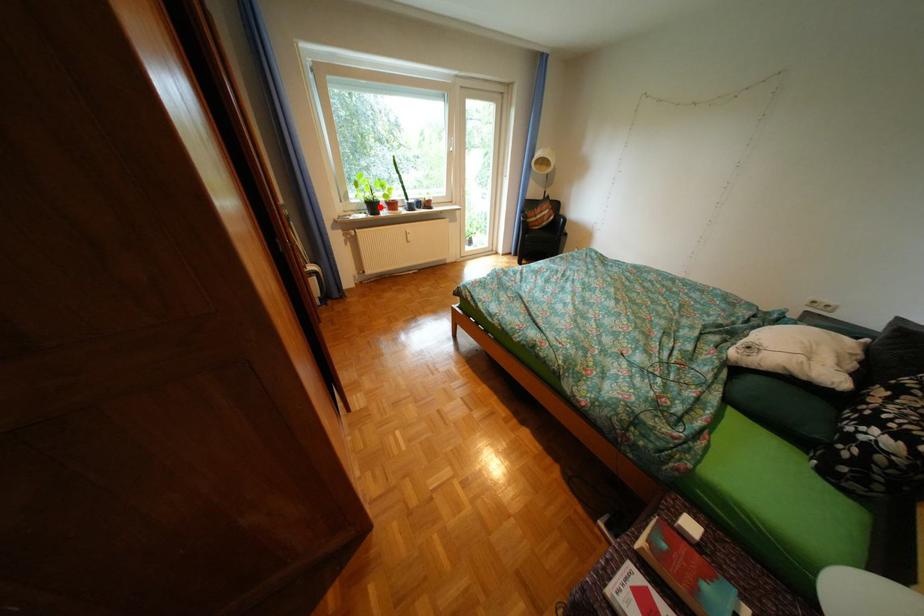
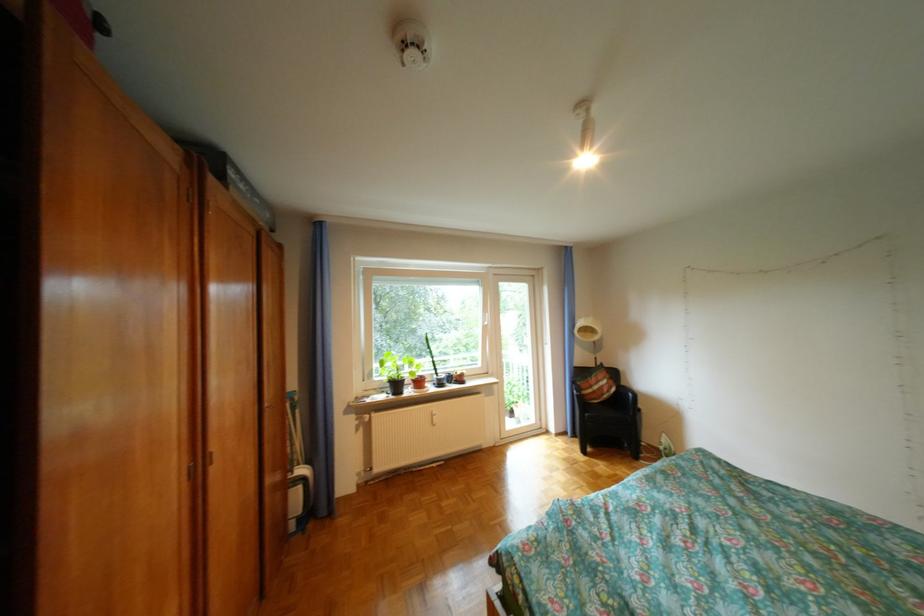
Question: I am providing you with two images of the same scene from different viewpoints. A red point is marked on the first image. Can you still see the location of the red point in image 2?

Choices:
 (A) Yes
 (B) No

Answer: (A)